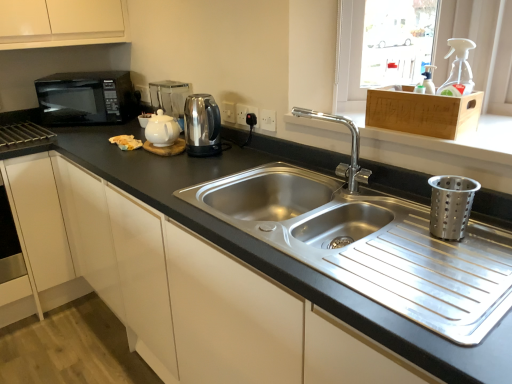
Question: Would you say stainless steel kettle at center is inside or outside white glossy tea pot at center?

Choices:
 (A) inside
 (B) outside

Answer: (B)

Question: In terms of size, does stainless steel kettle at center appear bigger or smaller than white glossy tea pot at center?

Choices:
 (A) big
 (B) small

Answer: (A)

Question: Which object is the closest to the wooden crate at upper right?

Choices:
 (A) stainless steel kettle at center
 (B) metallic silver coffee machine at upper center
 (C) black granite countertop at center
 (D) polished stainless steel faucet at center
 (E) wooden crate at upper right

Answer: (E)

Question: Based on their relative distances, which object is nearer to the wooden crate at upper right?

Choices:
 (A) black matte microwave at left
 (B) wooden crate at upper right
 (C) metallic silver coffee machine at upper center
 (D) stainless steel kettle at center
 (E) polished stainless steel faucet at center

Answer: (B)